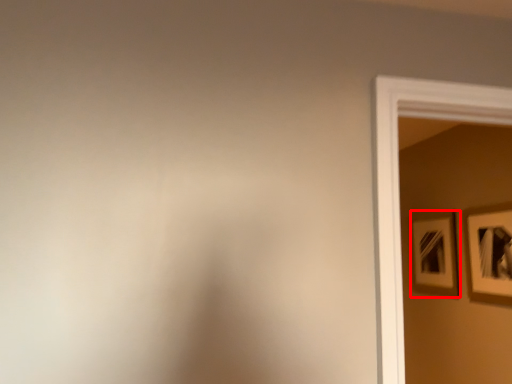
Question: Observing the image, what is the correct spatial positioning of picture frame (annotated by the red box) in reference to picture frame?

Choices:
 (A) left
 (B) right

Answer: (A)